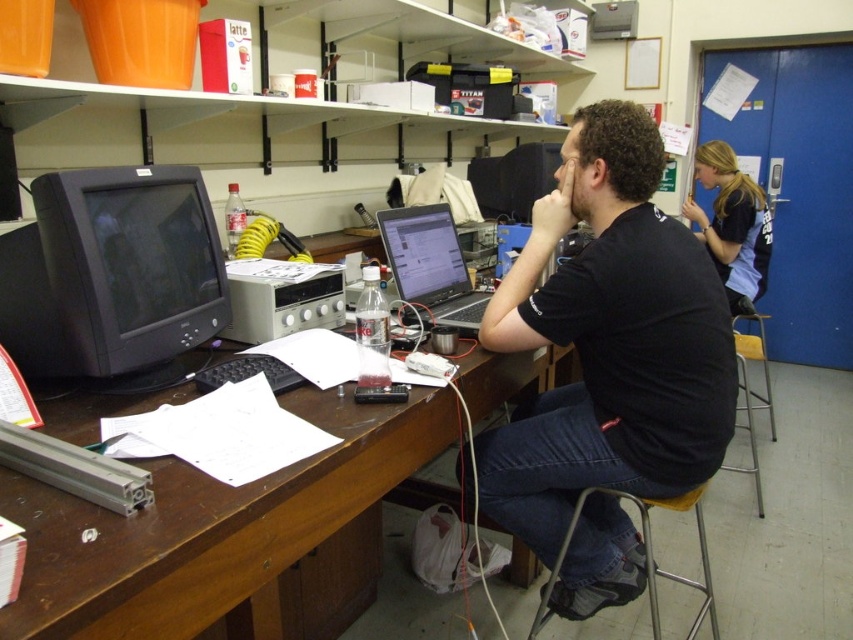
Looking at this image, can you confirm if black cotton shirt at center is positioned below brown wood computer desk at center?

Incorrect, black cotton shirt at center is not positioned below brown wood computer desk at center.

What are the coordinates of `black cotton shirt at center` in the screenshot? It's located at pyautogui.click(x=608, y=340).

Is brown wood computer desk at center wider than silver metallic laptop at center?

Yes.

Who is positioned more to the right, brown wood computer desk at center or silver metallic laptop at center?

From the viewer's perspective, silver metallic laptop at center appears more on the right side.

Where is `brown wood computer desk at center`? The image size is (853, 640). brown wood computer desk at center is located at coordinates (215, 528).

You are a GUI agent. You are given a task and a screenshot of the screen. Output one action in this format:
    pyautogui.click(x=<x>, y=<y>)
    Task: Click on the brown wood computer desk at center
    
    Given the screenshot: What is the action you would take?
    pyautogui.click(x=215, y=528)

Can you confirm if matte black monitor at left is bigger than silver metallic laptop at center?

Indeed, matte black monitor at left has a larger size compared to silver metallic laptop at center.

Which is below, matte black monitor at left or silver metallic laptop at center?

Positioned lower is matte black monitor at left.

Describe the element at coordinates (111, 273) in the screenshot. This screenshot has height=640, width=853. I see `matte black monitor at left` at that location.

Identify the location of matte black monitor at left. This screenshot has height=640, width=853. (111, 273).